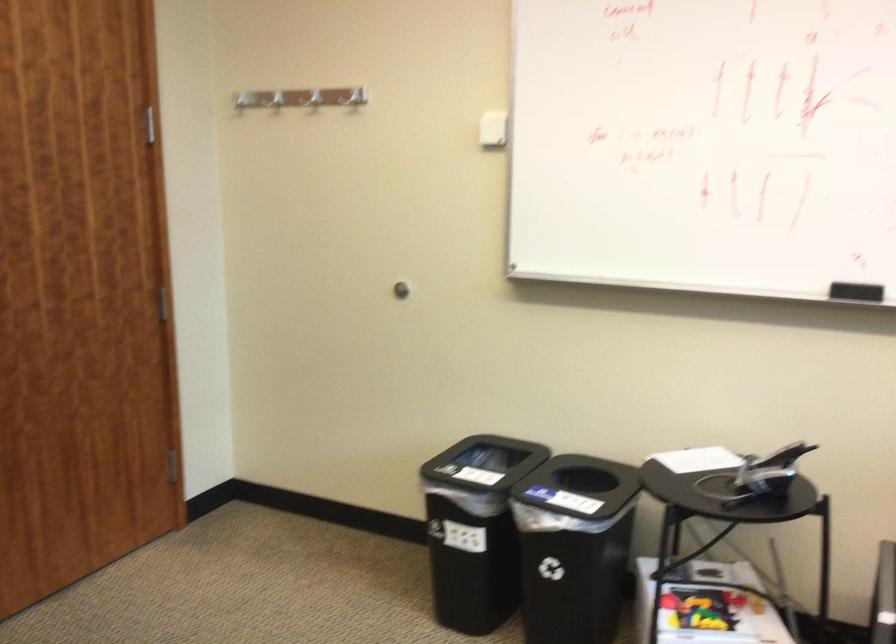
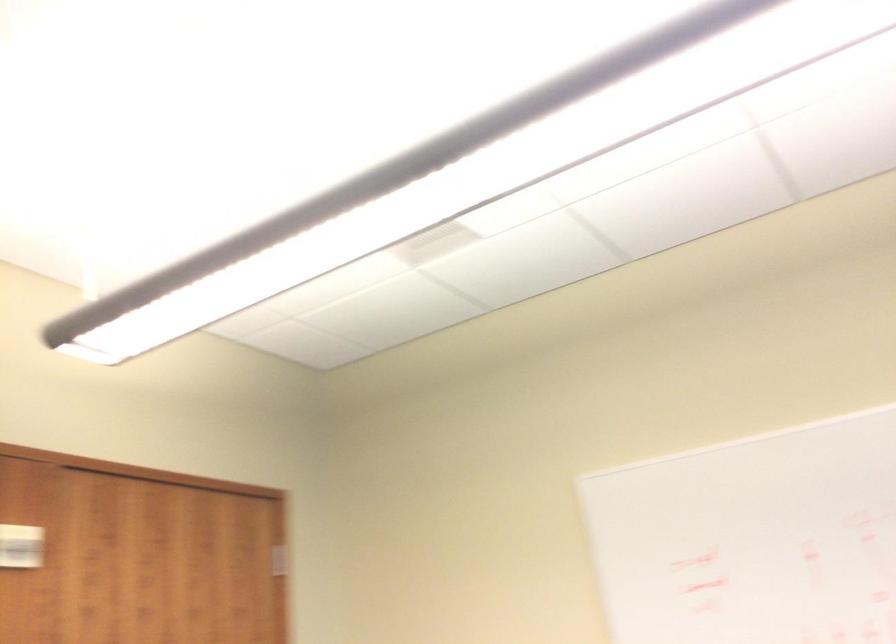
Question: How did the camera likely rotate?

Choices:
 (A) Left
 (B) Right
 (C) Up
 (D) Down

Answer: (C)